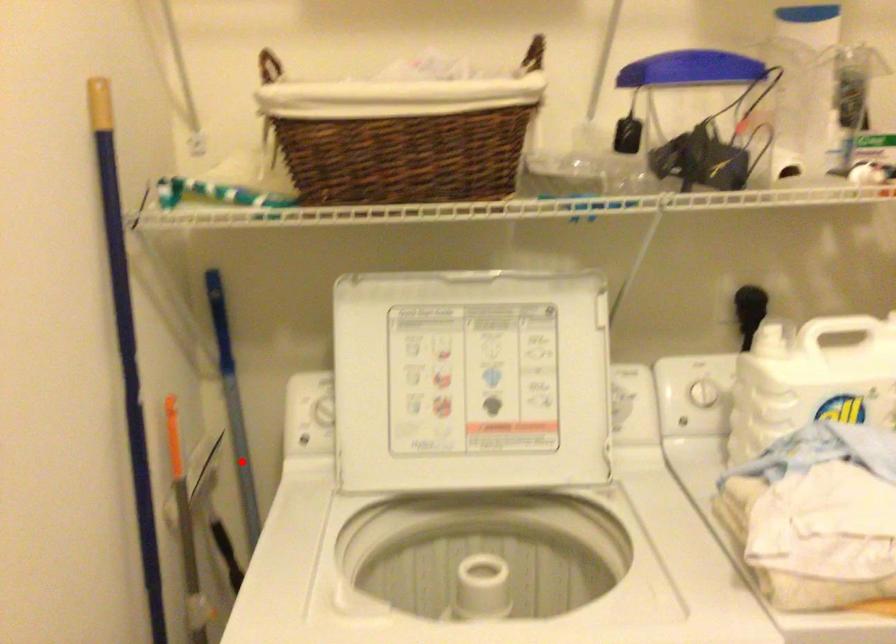
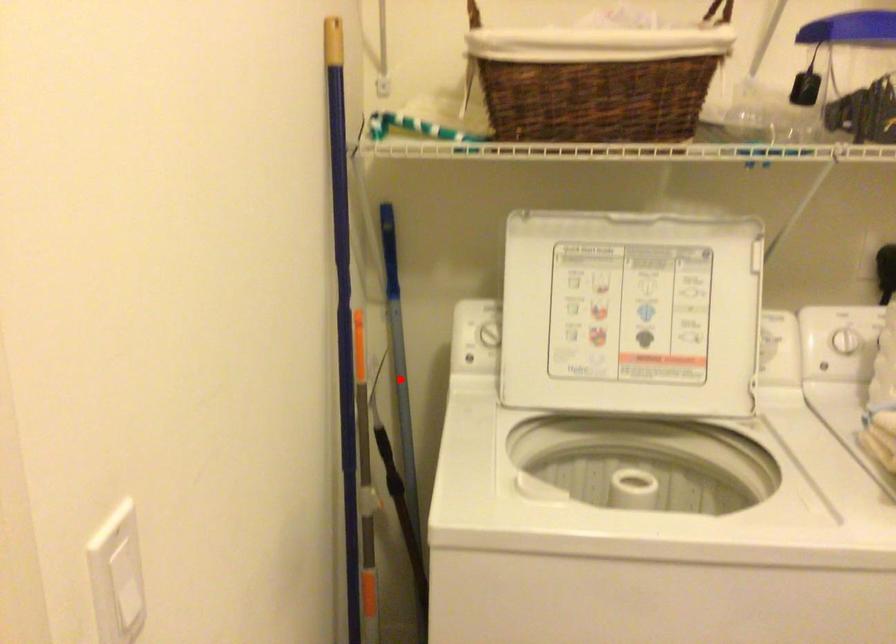
I am providing you with two images of the same scene from different viewpoints. A red point is marked on the first image and another point is marked on the second image. Are the points marked in image1 and image2 representing the same 3D position?

Yes